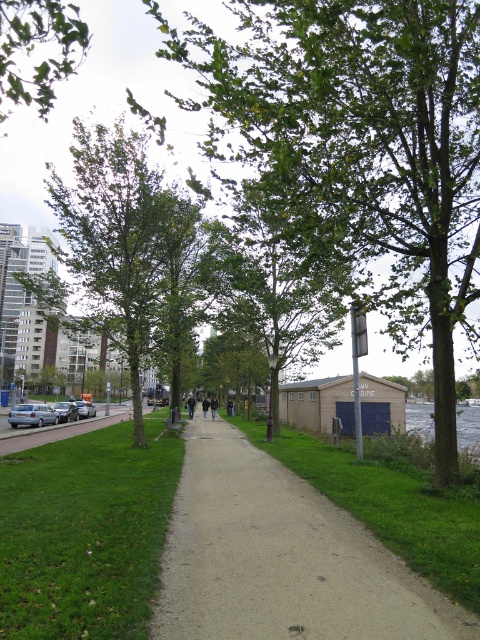
Consider the image. Who is higher up, green leafy tree at center or green grass at lower left?

green leafy tree at center is higher up.

Is point (432, 26) positioned before point (72, 497)?

Yes, it is in front of point (72, 497).

Is point (203, 26) closer to camera compared to point (36, 531)?

No, (203, 26) is further to viewer.

The image size is (480, 640). Find the location of `green leafy tree at center`. green leafy tree at center is located at coordinates (360, 148).

Looking at this image, is green leafy tree at center taller than silver metallic car at left?

Yes, green leafy tree at center is taller than silver metallic car at left.

Looking at this image, which is below, green leafy tree at center or silver metallic car at left?

silver metallic car at left

Who is more distant from viewer, (x=478, y=122) or (x=11, y=412)?

The point (x=11, y=412) is behind.

Locate an element on the screen. green leafy tree at center is located at coordinates (360, 148).

Can you confirm if smooth concrete path at center is shorter than green leafy tree at upper left?

Yes, smooth concrete path at center is shorter than green leafy tree at upper left.

What do you see at coordinates (280, 557) in the screenshot? The width and height of the screenshot is (480, 640). I see `smooth concrete path at center` at bounding box center [280, 557].

Locate an element on the screen. Image resolution: width=480 pixels, height=640 pixels. smooth concrete path at center is located at coordinates (280, 557).